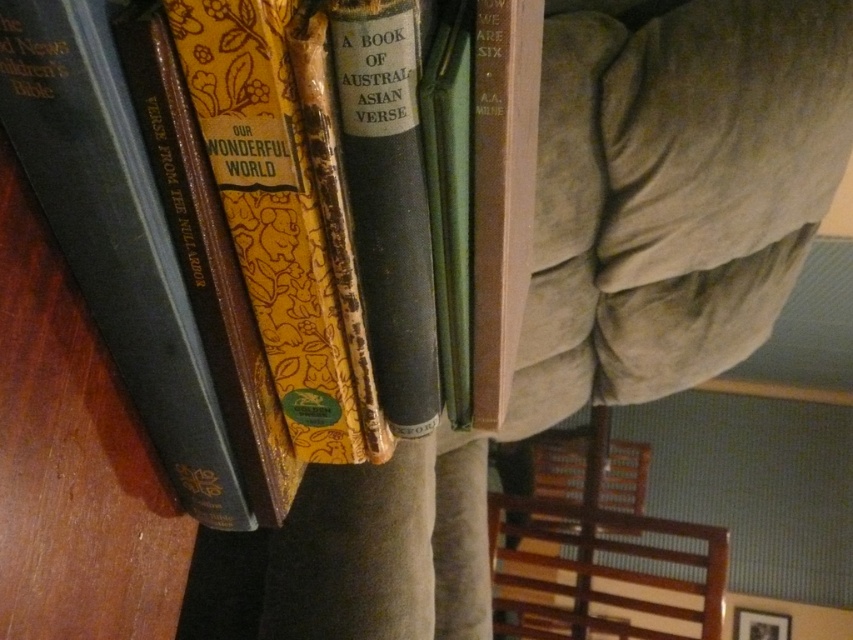
What do you see at coordinates (187, 237) in the screenshot?
I see `yellow paperback book at center` at bounding box center [187, 237].

From the picture: Does yellow paperback book at center have a lesser width compared to brown wooden chair at lower right?

Correct, yellow paperback book at center's width is less than brown wooden chair at lower right's.

Between point (173, 3) and point (508, 586), which one is positioned behind?

The point (508, 586) is more distant.

You are a GUI agent. You are given a task and a screenshot of the screen. Output one action in this format:
    pyautogui.click(x=<x>, y=<y>)
    Task: Click on the yellow paperback book at center
    Image resolution: width=853 pixels, height=640 pixels.
    Given the screenshot: What is the action you would take?
    pyautogui.click(x=187, y=237)

Does yellow paperback book at center appear over hardcover book at center?

No.

Can you confirm if yellow paperback book at center is smaller than hardcover book at center?

No, yellow paperback book at center is not smaller than hardcover book at center.

Does point (293, 124) lie in front of point (537, 36)?

Yes, it is.

Locate an element on the screen. yellow paperback book at center is located at coordinates (187, 237).

Who is more forward, (100, 332) or (569, 534)?

Point (100, 332) is in front.

Which is more to the left, hardcover book at left or brown wooden chair at lower right?

hardcover book at left

What do you see at coordinates (115, 236) in the screenshot?
I see `hardcover book at left` at bounding box center [115, 236].

The width and height of the screenshot is (853, 640). Find the location of `hardcover book at left`. hardcover book at left is located at coordinates (115, 236).